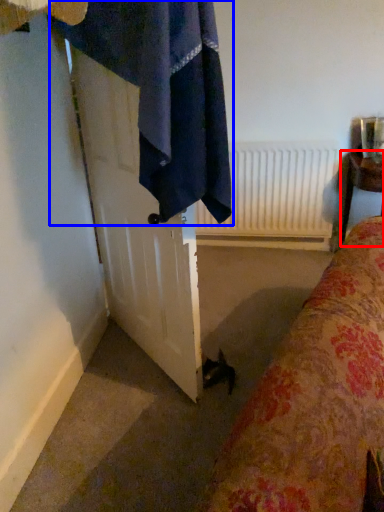
Question: Which object is further to the camera taking this photo, furniture (highlighted by a red box) or bath towel (highlighted by a blue box)?

Choices:
 (A) furniture
 (B) bath towel

Answer: (A)